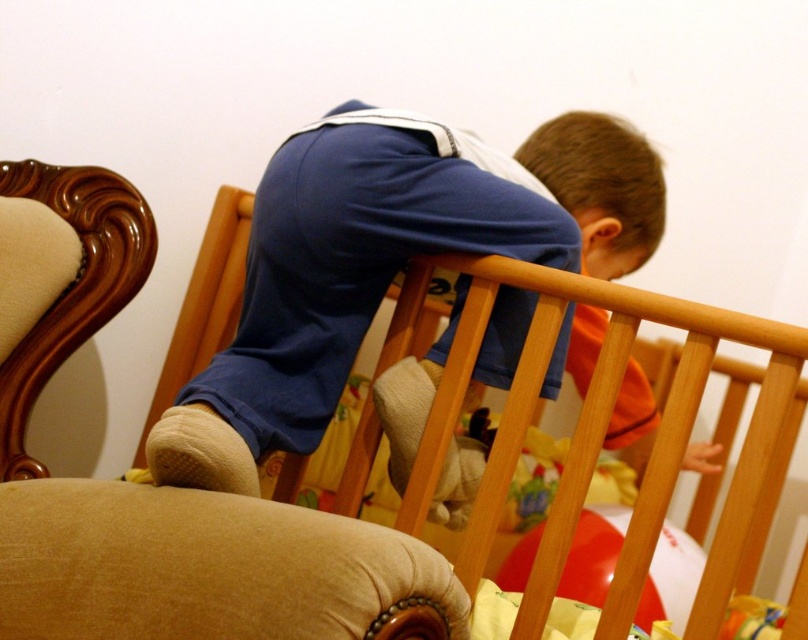
Looking at this image, you are a photographer setting up a shoot in this room. You need to ensure that the blue cotton shirt at center and the wooden crib at upper center are both visible in the frame. Given their sizes, which object should you prioritize positioning closer to the camera to maintain clarity and detail?

The blue cotton shirt at center is bigger than the wooden crib at upper center, so to maintain clarity and detail, prioritize positioning the wooden crib at upper center closer to the camera since smaller objects need to be nearer to ensure they are visible and detailed in the photograph.

You are a parent looking at the image. You notice the blue cotton shirt at center and the wooden crib at upper center. Which object is positioned higher in the image?

The blue cotton shirt at center is located above the wooden crib at upper center, so the blue cotton shirt at center is higher in the image.